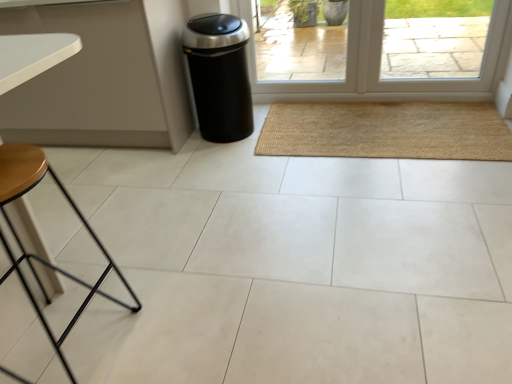
Question: From a real-world perspective, is wooden stool at lower left on top of transparent glass door at center?

Choices:
 (A) no
 (B) yes

Answer: (A)

Question: Does wooden stool at lower left have a lesser height compared to transparent glass door at center?

Choices:
 (A) no
 (B) yes

Answer: (A)

Question: From a real-world perspective, is wooden stool at lower left located beneath transparent glass door at center?

Choices:
 (A) yes
 (B) no

Answer: (A)

Question: Is wooden stool at lower left closer to camera compared to transparent glass door at center?

Choices:
 (A) yes
 (B) no

Answer: (A)

Question: Is wooden stool at lower left not near transparent glass door at center?

Choices:
 (A) yes
 (B) no

Answer: (A)

Question: Is wooden stool at lower left behind transparent glass door at center?

Choices:
 (A) yes
 (B) no

Answer: (B)

Question: Is transparent glass door at center in front of wooden stool at lower left?

Choices:
 (A) no
 (B) yes

Answer: (A)

Question: Can you confirm if transparent glass door at center is smaller than wooden stool at lower left?

Choices:
 (A) yes
 (B) no

Answer: (A)

Question: Is transparent glass door at center completely or partially outside of wooden stool at lower left?

Choices:
 (A) no
 (B) yes

Answer: (B)

Question: From a real-world perspective, does transparent glass door at center sit lower than wooden stool at lower left?

Choices:
 (A) no
 (B) yes

Answer: (A)

Question: Is transparent glass door at center touching wooden stool at lower left?

Choices:
 (A) no
 (B) yes

Answer: (A)

Question: Considering the relative sizes of transparent glass door at center and wooden stool at lower left in the image provided, is transparent glass door at center bigger than wooden stool at lower left?

Choices:
 (A) yes
 (B) no

Answer: (B)

Question: Would you say black matte trash can at center-left is a long distance from transparent glass door at center?

Choices:
 (A) yes
 (B) no

Answer: (B)